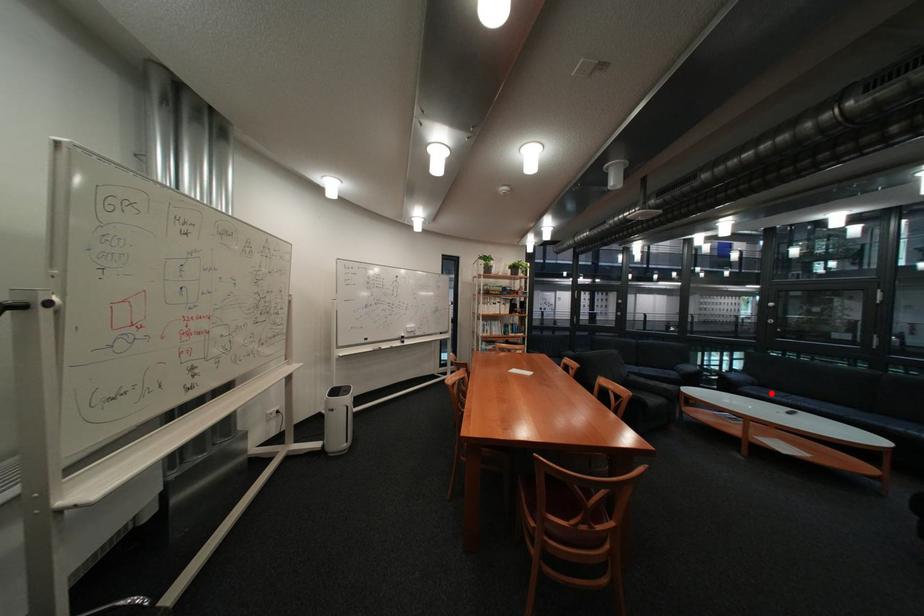
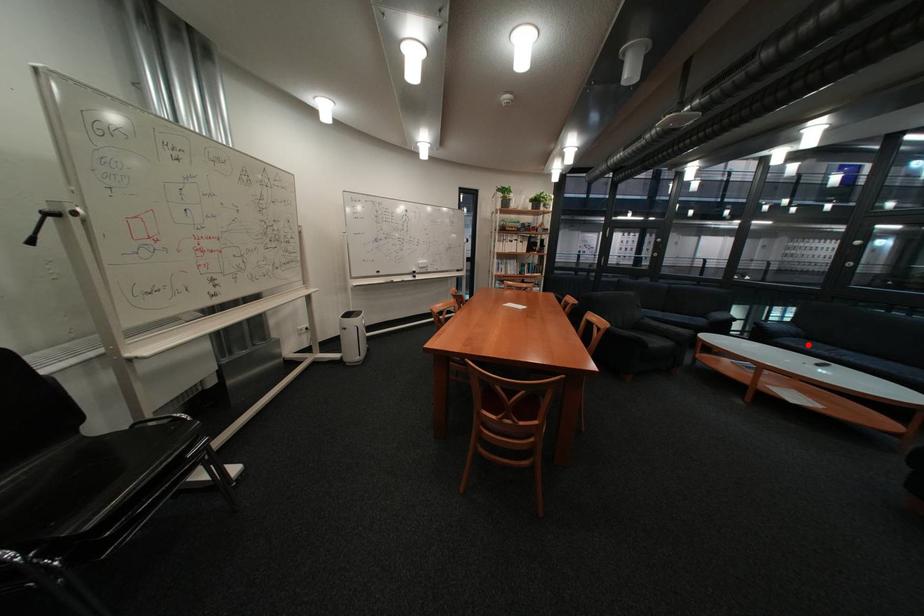
I am providing you with two images of the same scene from different viewpoints. A red point is marked on the first image and another point is marked on the second image. Do the highlighted points in image1 and image2 indicate the same real-world spot?

Yes